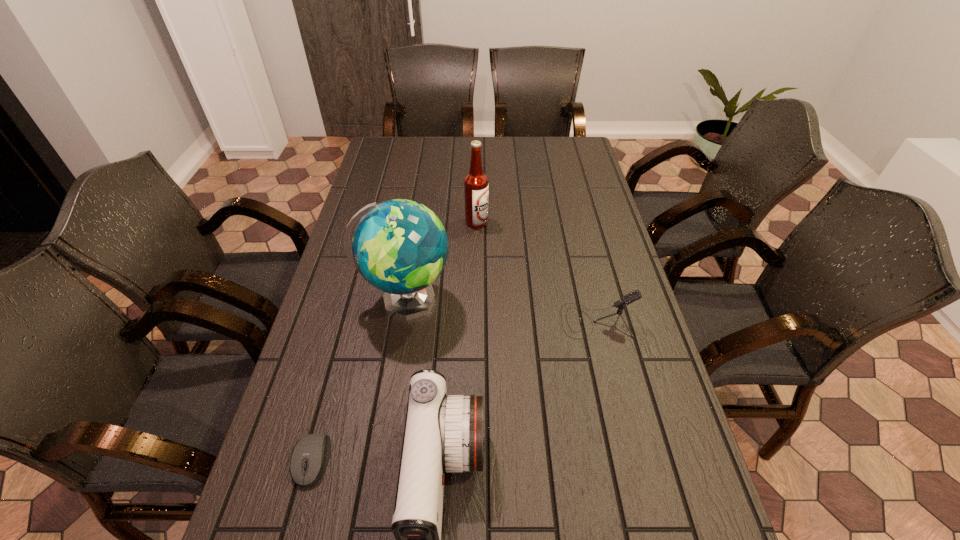
You are a GUI agent. You are given a task and a screenshot of the screen. Output one action in this format:
    pyautogui.click(x=<x>, y=<y>)
    Task: Click on the globe
    The height and width of the screenshot is (540, 960).
    Given the screenshot: What is the action you would take?
    400,247

Locate an element on the screen. The width and height of the screenshot is (960, 540). alcohol is located at coordinates (476, 186).

Where is `microphone`? This screenshot has height=540, width=960. microphone is located at coordinates (635, 295).

This screenshot has height=540, width=960. In order to click on the rightmost object in this screenshot , I will do `click(635, 295)`.

You are a GUI agent. You are given a task and a screenshot of the screen. Output one action in this format:
    pyautogui.click(x=<x>, y=<y>)
    Task: Click on the computer equipment
    
    Given the screenshot: What is the action you would take?
    pyautogui.click(x=310, y=456)

Identify the location of vacant space located on the front surface of the globe. coord(545,300).

Where is `free spot located 0.220m on the label side of the farthest object`? The image size is (960, 540). free spot located 0.220m on the label side of the farthest object is located at coordinates (551, 222).

The width and height of the screenshot is (960, 540). Identify the location of vacant space located on the stand of the microphone. (492, 320).

Locate an element on the screen. The width and height of the screenshot is (960, 540). free space located on the stand of the microphone is located at coordinates tap(445, 320).

The image size is (960, 540). In order to click on free spot located 0.240m on the stand of the microphone in this screenshot , I will do `click(474, 320)`.